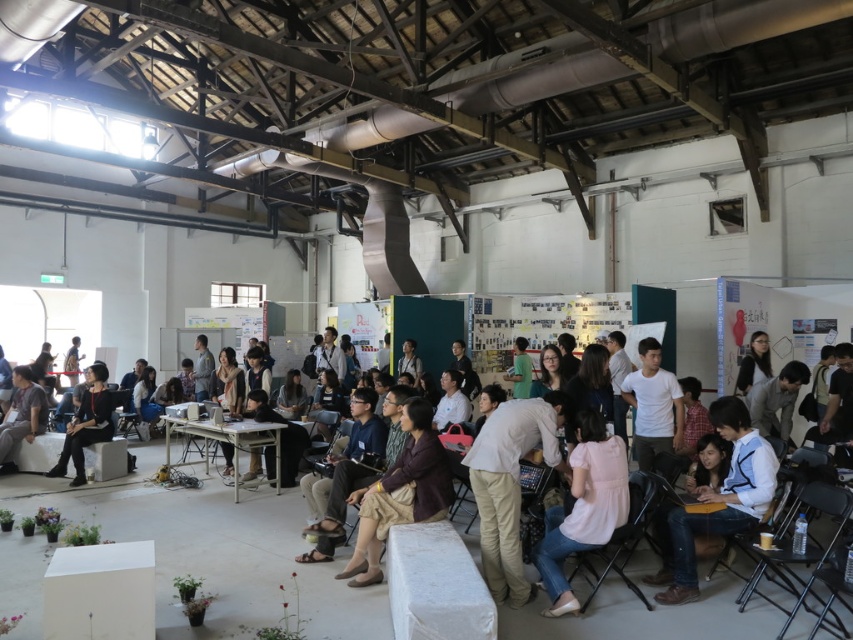
Question: Which point is farther from the camera taking this photo?

Choices:
 (A) (202, 445)
 (B) (55, 472)

Answer: (A)

Question: Does matte black jacket at center have a greater width compared to black fabric dress at lower left?

Choices:
 (A) yes
 (B) no

Answer: (A)

Question: Which object is the closest to the black fabric dress at lower left?

Choices:
 (A) light beige pants at center
 (B) gray fabric shirt at lower left
 (C) metallic gray table at center
 (D) matte black jacket at center

Answer: (D)

Question: Is light beige pants at center positioned behind white shirt at center?

Choices:
 (A) yes
 (B) no

Answer: (B)

Question: Where is light beige pants at center located in relation to dark purple fabric dress at center in the image?

Choices:
 (A) below
 (B) above

Answer: (B)

Question: Which object appears closest to the camera in this image?

Choices:
 (A) black fabric dress at lower left
 (B) light beige pants at center
 (C) metallic gray table at center
 (D) matte black jacket at center

Answer: (B)